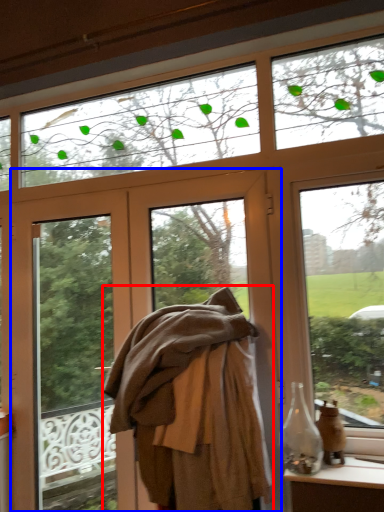
Question: Which object appears closest to the camera in this image, clothing (highlighted by a red box) or door (highlighted by a blue box)?

Choices:
 (A) clothing
 (B) door

Answer: (A)